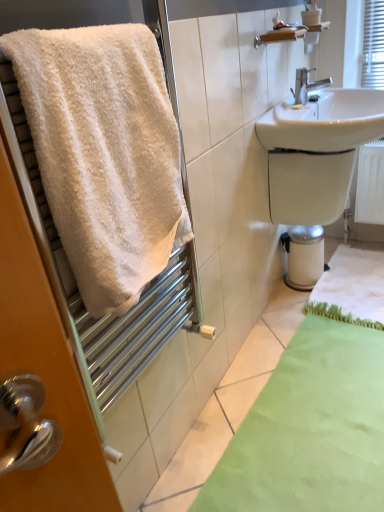
Question: From a real-world perspective, is white glossy bidet at lower right physically above silver metallic faucet at upper right?

Choices:
 (A) yes
 (B) no

Answer: (B)

Question: Is white glossy bidet at lower right oriented towards silver metallic faucet at upper right?

Choices:
 (A) yes
 (B) no

Answer: (B)

Question: Is white glossy bidet at lower right taller than silver metallic faucet at upper right?

Choices:
 (A) no
 (B) yes

Answer: (B)

Question: Would you say white glossy bidet at lower right is outside silver metallic faucet at upper right?

Choices:
 (A) yes
 (B) no

Answer: (A)

Question: Does white glossy bidet at lower right contain silver metallic faucet at upper right?

Choices:
 (A) no
 (B) yes

Answer: (A)

Question: Would you consider white glossy bidet at lower right to be distant from silver metallic faucet at upper right?

Choices:
 (A) yes
 (B) no

Answer: (B)

Question: Is white glossy bidet at lower right further to the viewer compared to green fuzzy bath mat at lower right, which ranks as the 2th bath mat in front-to-back order?

Choices:
 (A) yes
 (B) no

Answer: (A)

Question: Can you confirm if white glossy bidet at lower right is bigger than green fuzzy bath mat at lower right, which ranks as the 2th bath mat in front-to-back order?

Choices:
 (A) no
 (B) yes

Answer: (A)

Question: Is white glossy bidet at lower right positioned with its back to green fuzzy bath mat at lower right, which ranks as the 2th bath mat in front-to-back order?

Choices:
 (A) no
 (B) yes

Answer: (A)

Question: Does white glossy bidet at lower right have a lesser width compared to green fuzzy bath mat at lower right, which ranks as the 2th bath mat in front-to-back order?

Choices:
 (A) yes
 (B) no

Answer: (A)

Question: Can you confirm if white glossy bidet at lower right is positioned to the right of green fuzzy bath mat at lower right, which ranks as the 2th bath mat in front-to-back order?

Choices:
 (A) yes
 (B) no

Answer: (B)

Question: Is white glossy bidet at lower right not close to green fuzzy bath mat at lower right, which ranks as the 2th bath mat in front-to-back order?

Choices:
 (A) no
 (B) yes

Answer: (A)

Question: Does green fuzzy bath mat at lower right, the 1th bath mat when ordered from back to front, have a greater width compared to white glossy bidet at lower right?

Choices:
 (A) yes
 (B) no

Answer: (A)